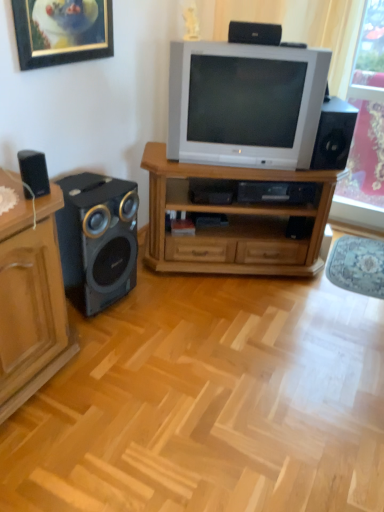
Question: Considering the relative positions of wooden tv stand at center and white plastic television at center in the image provided, is wooden tv stand at center behind white plastic television at center?

Choices:
 (A) yes
 (B) no

Answer: (A)

Question: Is wooden tv stand at center placed right next to white plastic television at center?

Choices:
 (A) yes
 (B) no

Answer: (B)

Question: Does wooden tv stand at center have a smaller size compared to white plastic television at center?

Choices:
 (A) no
 (B) yes

Answer: (A)

Question: Is wooden tv stand at center taller than white plastic television at center?

Choices:
 (A) yes
 (B) no

Answer: (A)

Question: Considering the relative sizes of wooden tv stand at center and white plastic television at center in the image provided, is wooden tv stand at center wider than white plastic television at center?

Choices:
 (A) no
 (B) yes

Answer: (B)

Question: From a real-world perspective, is wooden tv stand at center positioned over white plastic television at center based on gravity?

Choices:
 (A) yes
 (B) no

Answer: (B)

Question: Is black matte speaker at left, the 1th loudspeaker viewed from the left, a part of pink floral curtain at right?

Choices:
 (A) yes
 (B) no

Answer: (B)

Question: Is pink floral curtain at right oriented away from black matte speaker at left, the 3th loudspeaker when ordered from top to bottom?

Choices:
 (A) yes
 (B) no

Answer: (B)

Question: Can you confirm if pink floral curtain at right is shorter than black matte speaker at left, the 1th loudspeaker viewed from the left?

Choices:
 (A) no
 (B) yes

Answer: (A)

Question: From a real-world perspective, is pink floral curtain at right located beneath black matte speaker at left, the second loudspeaker positioned from the bottom?

Choices:
 (A) yes
 (B) no

Answer: (A)

Question: Is pink floral curtain at right completely or partially outside of black matte speaker at left, the second loudspeaker positioned from the bottom?

Choices:
 (A) no
 (B) yes

Answer: (B)

Question: Considering the relative sizes of pink floral curtain at right and black matte speaker at left, placed as the 4th loudspeaker when sorted from right to left, in the image provided, is pink floral curtain at right wider than black matte speaker at left, placed as the 4th loudspeaker when sorted from right to left,?

Choices:
 (A) yes
 (B) no

Answer: (B)

Question: Is black plastic speaker at right, the fourth loudspeaker positioned from the left, bigger than matte wood cabinet at left?

Choices:
 (A) yes
 (B) no

Answer: (B)